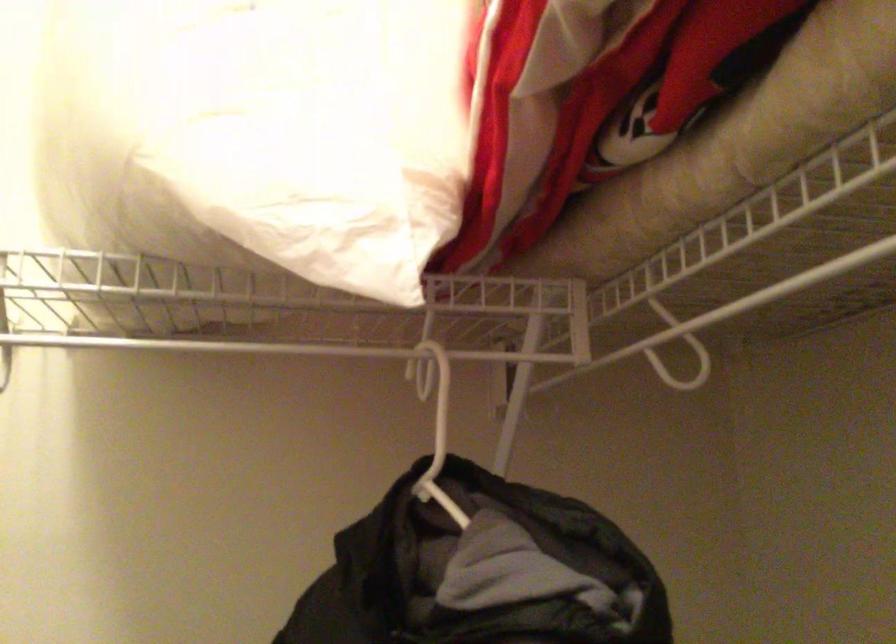
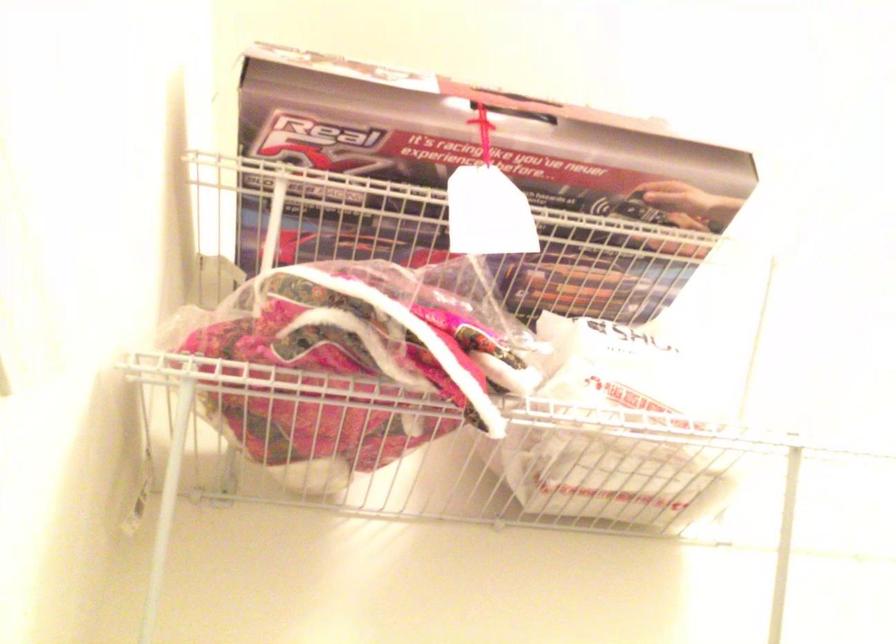
Question: The images are taken continuously from a first-person perspective. In which direction are you moving?

Choices:
 (A) Left
 (B) Right
 (C) Forward
 (D) Backward

Answer: (A)